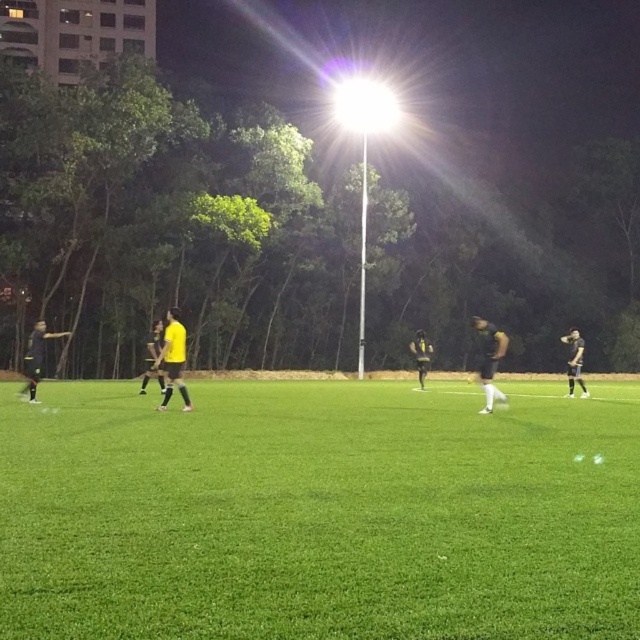
You are a photographer standing at the edge of the soccer field. You want to take a photo that includes both the yellow matte jersey at center and the black matte soccer player at left. Which object should you focus on first to ensure both are in frame?

The yellow matte jersey at center has a smaller size compared to black matte soccer player at left. To ensure both are in frame, focus on the larger object first, which is the black matte soccer player at left, then adjust the camera to include the smaller yellow matte jersey at center.

You are a photographer trying to capture a shot of the soccer game. You want to position yourself so that the yellow matte jersey at center and the black matte soccer player at left are both visible in the frame. Based on their positions, which player should you place on the left side of your photo?

The black matte soccer player at left should be placed on the left side of your photo because the yellow matte jersey at center is to the right of the black matte soccer player at left.

You are a drone operator trying to capture a closeup of the black matte soccer player at right. The camera is currently positioned at the center of the soccer field. To get the best shot, you need to move the camera towards the point marked at (573,362). In which direction should you move the camera to reach the black matte soccer player at right?

The point at (573,362) marks the location of the black matte soccer player at right. Since the camera is at the center of the soccer field, moving towards this point would require moving towards the right side of the field to reach the black matte soccer player at right.